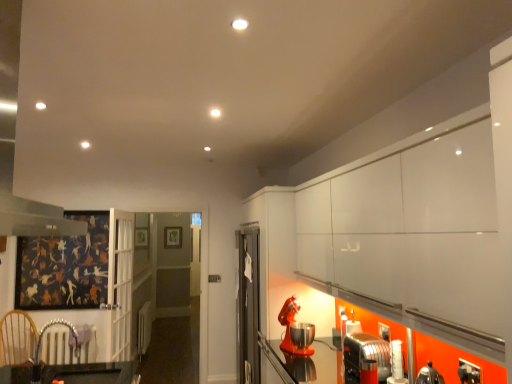
Question: Based on their positions, is wooden armchair at lower left located to the left or right of metallic silver toaster at lower right, which is the 2th appliance from left to right?

Choices:
 (A) left
 (B) right

Answer: (A)

Question: Is wooden armchair at lower left situated inside metallic silver toaster at lower right, the 2th appliance from the back, or outside?

Choices:
 (A) outside
 (B) inside

Answer: (A)

Question: Based on their relative distances, which object is nearer to the orange matte stand mixer at lower right, the first appliance positioned from the back?

Choices:
 (A) metallic silver toaster at lower right, marked as the 1th appliance in a right-to-left arrangement
 (B) wooden armchair at lower left

Answer: (A)

Question: Based on their relative distances, which object is farther from the wooden armchair at lower left?

Choices:
 (A) orange matte stand mixer at lower right, the first appliance positioned from the back
 (B) metallic silver toaster at lower right, the 2th appliance from the back

Answer: (B)